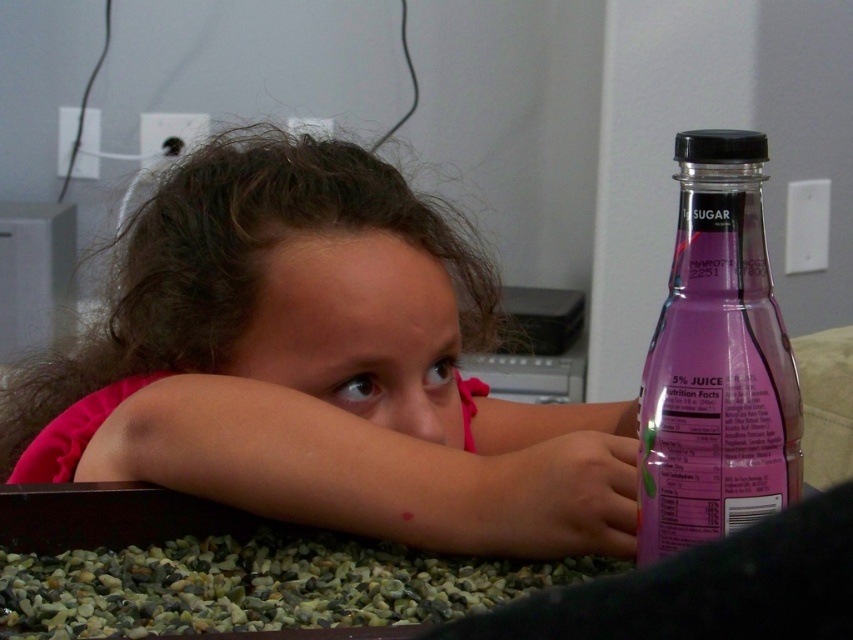
Question: Is pink fabric at center positioned in front of purple glass bottle at right?

Choices:
 (A) no
 (B) yes

Answer: (A)

Question: Which point is closer to the camera?

Choices:
 (A) translucent plastic hand at lower right
 (B) pink fabric at center
 (C) purple glass bottle at right

Answer: (C)

Question: Among these points, which one is nearest to the camera?

Choices:
 (A) pos(637,522)
 (B) pos(431,209)
 (C) pos(560,465)

Answer: (A)

Question: Which point is closer to the camera?

Choices:
 (A) pink fabric at center
 (B) purple glass bottle at right

Answer: (B)

Question: Does purple glass bottle at right lie in front of translucent plastic hand at lower right?

Choices:
 (A) yes
 (B) no

Answer: (A)

Question: Is pink fabric at center thinner than purple glass bottle at right?

Choices:
 (A) yes
 (B) no

Answer: (B)